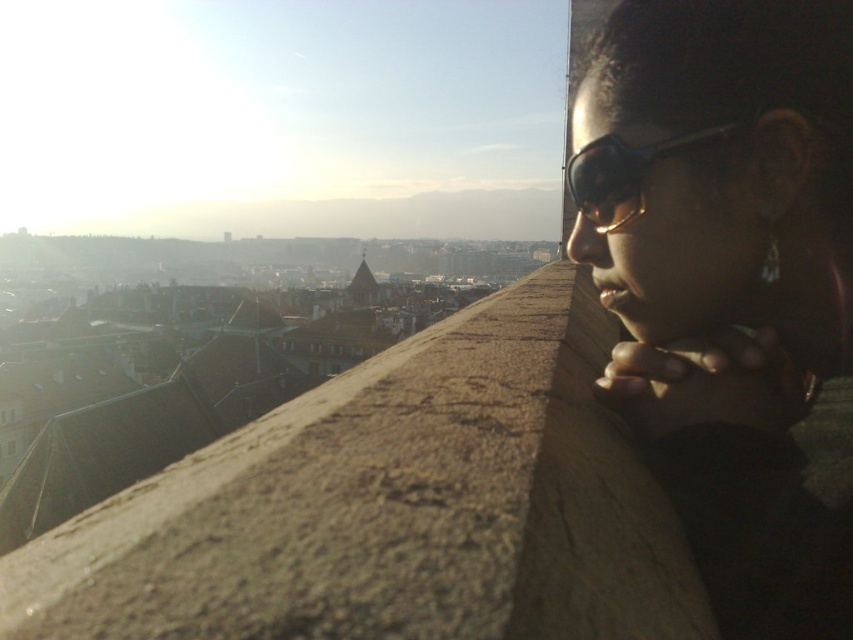
Question: From the image, what is the correct spatial relationship of matte black sunglasses at upper right in relation to black matte goggles at upper right?

Choices:
 (A) above
 (B) below

Answer: (B)

Question: Among these objects, which one is nearest to the camera?

Choices:
 (A) matte black sunglasses at upper right
 (B) black matte goggles at upper right

Answer: (A)

Question: Is matte black sunglasses at upper right positioned before black matte goggles at upper right?

Choices:
 (A) yes
 (B) no

Answer: (A)

Question: Which of the following is the closest to the observer?

Choices:
 (A) (584, 170)
 (B) (680, 138)

Answer: (B)

Question: Can you confirm if matte black sunglasses at upper right is positioned to the right of black matte goggles at upper right?

Choices:
 (A) no
 (B) yes

Answer: (B)